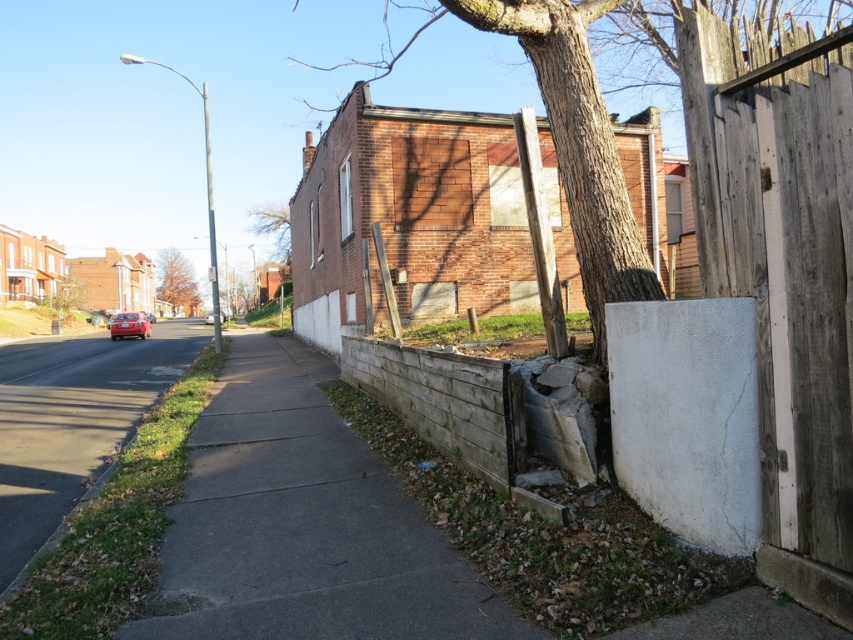
Question: Does gray concrete sidewalk at center appear on the right side of shiny red car at left?

Choices:
 (A) no
 (B) yes

Answer: (B)

Question: Does brown rough bark tree at center have a lesser width compared to green leafy tree at upper center?

Choices:
 (A) no
 (B) yes

Answer: (A)

Question: Which point appears closest to the camera in this image?

Choices:
 (A) (682, 68)
 (B) (560, 35)
 (C) (180, 273)
 (D) (109, 342)

Answer: (A)

Question: Which object is closer to the camera taking this photo?

Choices:
 (A) brown textured tree at upper center
 (B) green asphalt sidewalk at lower left

Answer: (B)

Question: Estimate the real-world distances between objects in this image. Which object is closer to the gray concrete sidewalk at center?

Choices:
 (A) shiny red car at left
 (B) weathered wood gate at right
 (C) brown textured tree at upper center

Answer: (B)

Question: Does weathered wood gate at right have a lesser width compared to brown textured tree at upper center?

Choices:
 (A) yes
 (B) no

Answer: (A)